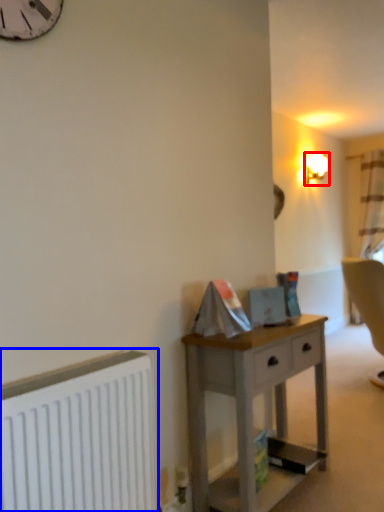
Question: Which object appears closest to the camera in this image, lamp (highlighted by a red box) or radiator (highlighted by a blue box)?

Choices:
 (A) lamp
 (B) radiator

Answer: (B)